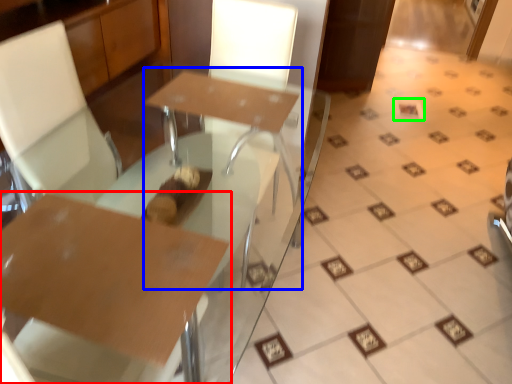
Question: Estimate the real-world distances between objects in this image. Which object is closer to table (highlighted by a red box), round table (highlighted by a blue box) or square (highlighted by a green box)?

Choices:
 (A) round table
 (B) square

Answer: (A)